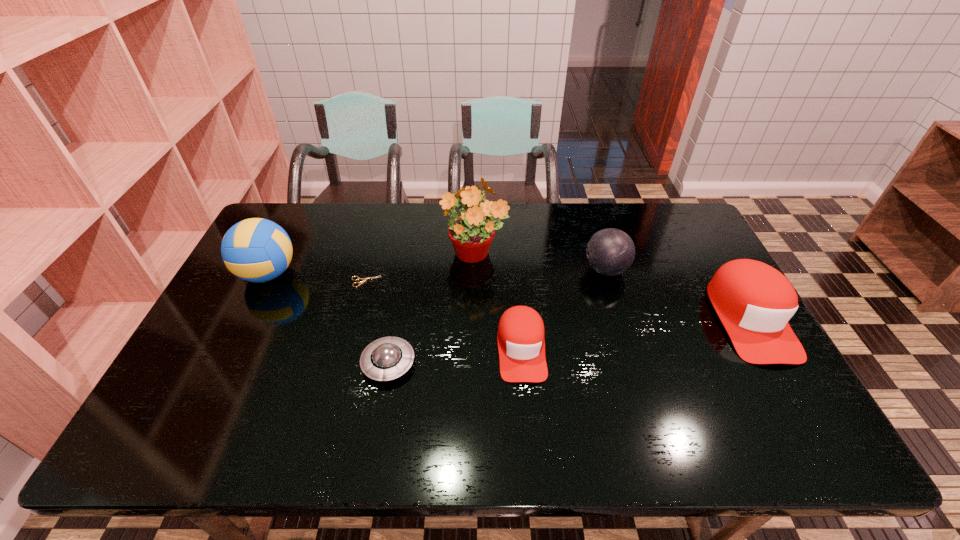
Identify the location of free location located on the front-facing side of the third shortest object. (526, 407).

Where is `vacant space located on the front-facing side of the right baseball cap`? The width and height of the screenshot is (960, 540). vacant space located on the front-facing side of the right baseball cap is located at coordinates (796, 399).

This screenshot has width=960, height=540. Find the location of `free region located on the back of the shears`. free region located on the back of the shears is located at coordinates (372, 259).

Identify the location of free spot located on the front of the flowerpot. The width and height of the screenshot is (960, 540). (473, 357).

Where is `free space located on the front of the sixth shortest object`? Image resolution: width=960 pixels, height=540 pixels. free space located on the front of the sixth shortest object is located at coordinates (249, 314).

Where is `vacant region located on the grip area of the second object from right to left`? This screenshot has width=960, height=540. vacant region located on the grip area of the second object from right to left is located at coordinates (551, 269).

This screenshot has width=960, height=540. What are the coordinates of `free space located on the grip area of the second object from right to left` in the screenshot? It's located at (522, 269).

What are the coordinates of `vacant space located on the grip area of the second object from right to left` in the screenshot? It's located at (566, 269).

The image size is (960, 540). I want to click on vacant region located 0.380m on the left of the second shortest object, so click(x=214, y=363).

Identify the location of object at the far edge. This screenshot has height=540, width=960. (471, 233).